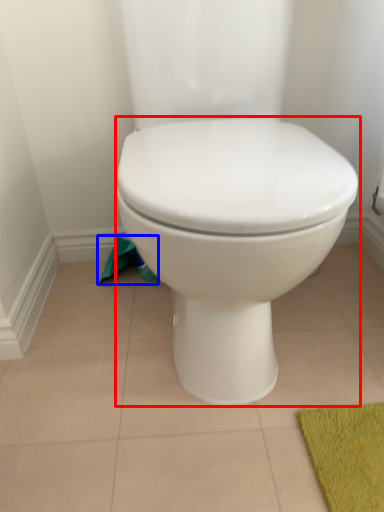
Question: Among these objects, which one is nearest to the camera, toilet (highlighted by a red box) or toilet paper (highlighted by a blue box)?

Choices:
 (A) toilet
 (B) toilet paper

Answer: (A)